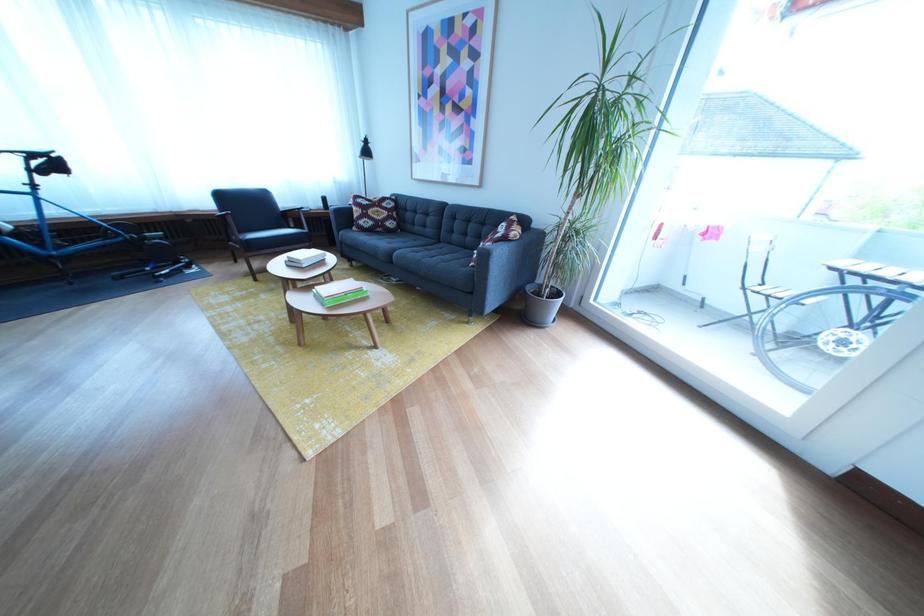
What do you see at coordinates (365, 150) in the screenshot? I see `the black lamp head` at bounding box center [365, 150].